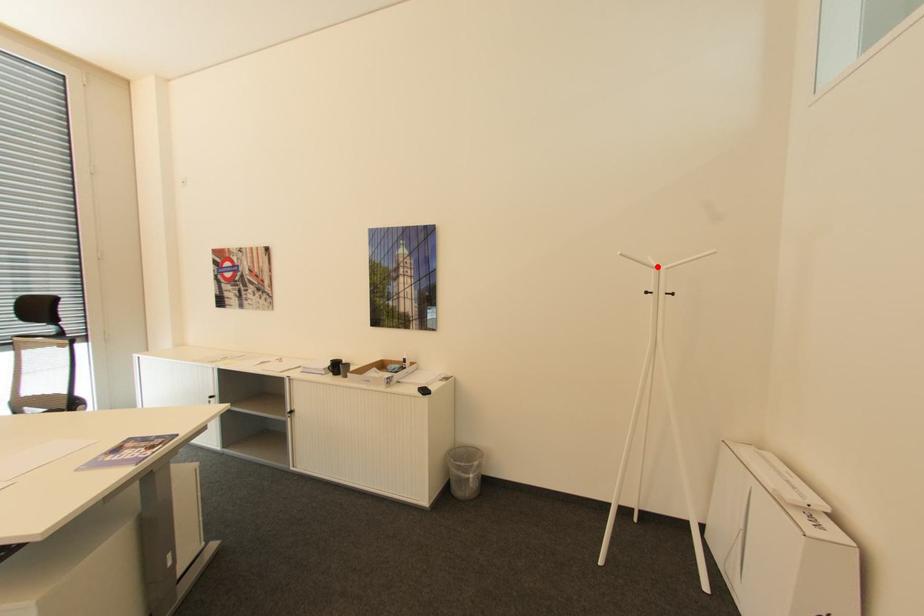
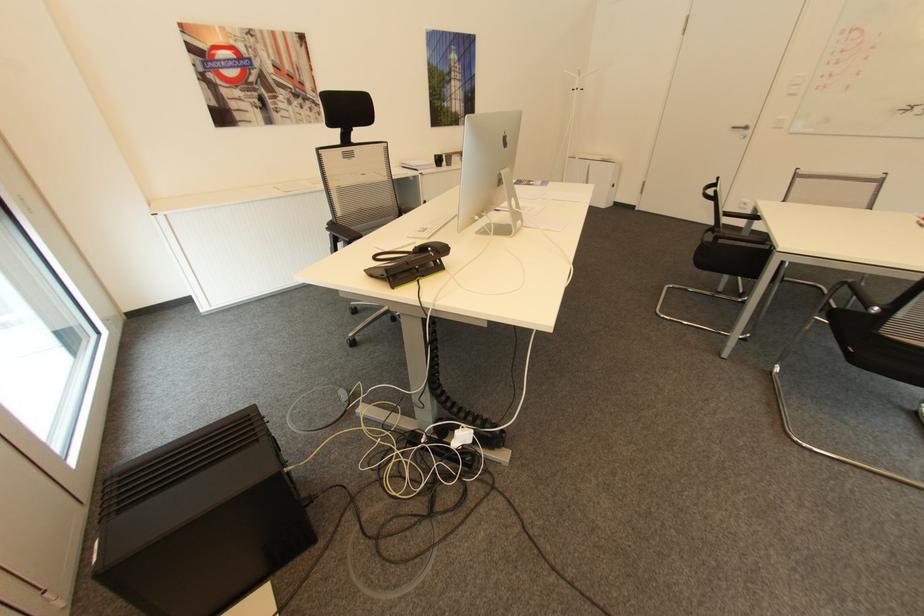
In the second image, find the point that corresponds to the highlighted location in the first image.

(582, 76)